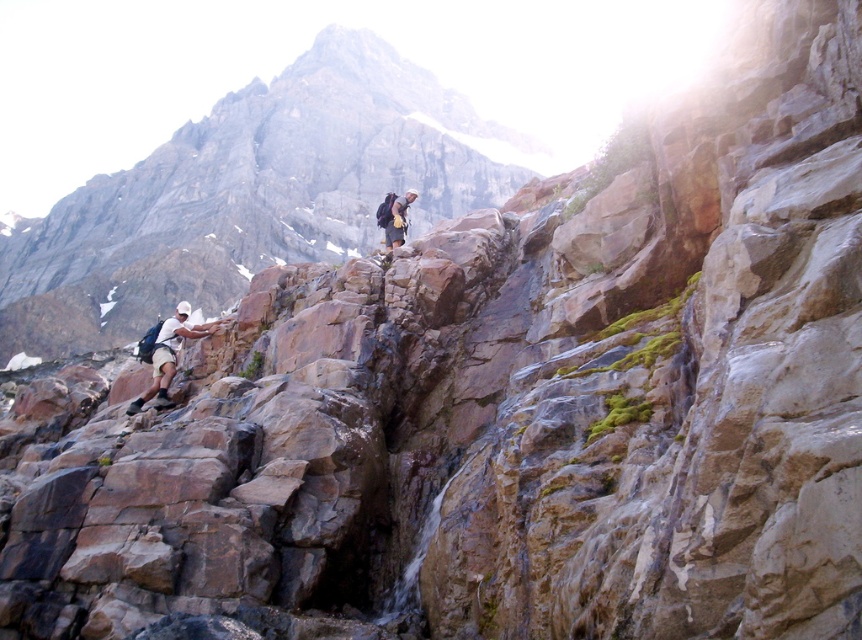
Between point (133, 333) and point (188, 301), which one is positioned behind?

The point (188, 301) is more distant.

Is point (320, 74) positioned in front of point (155, 336)?

That is False.

Image resolution: width=862 pixels, height=640 pixels. I want to click on brown rock at left, so click(x=251, y=195).

Who is positioned more to the right, matte black backpack at left or matte black backpack at center?

matte black backpack at center

Who is more forward, (141, 353) or (383, 212)?

Point (141, 353)

This screenshot has height=640, width=862. Describe the element at coordinates (166, 353) in the screenshot. I see `matte black backpack at left` at that location.

The image size is (862, 640). Identify the location of matte black backpack at left. (166, 353).

Looking at this image, which is more to the right, brown rock at left or matte black backpack at center?

matte black backpack at center

Who is more distant from viewer, (x=216, y=202) or (x=378, y=208)?

Point (x=216, y=202)

This screenshot has height=640, width=862. I want to click on brown rock at left, so [251, 195].